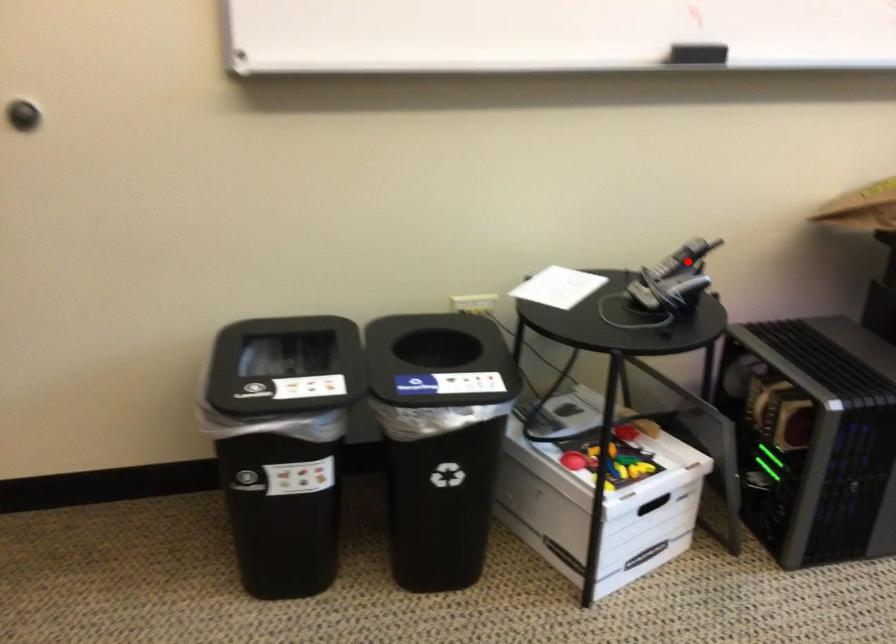
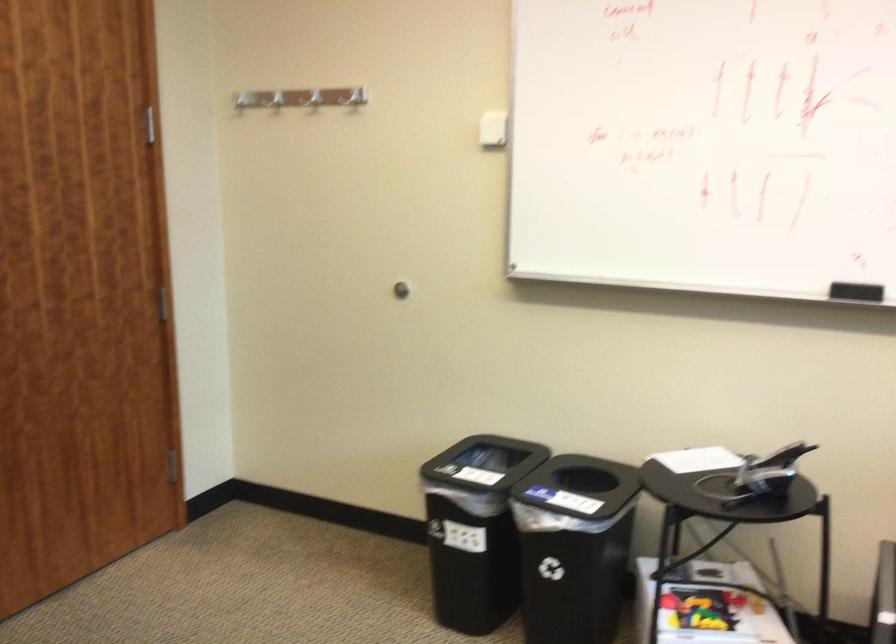
In the second image, find the point that corresponds to the highlighted location in the first image.

(782, 456)